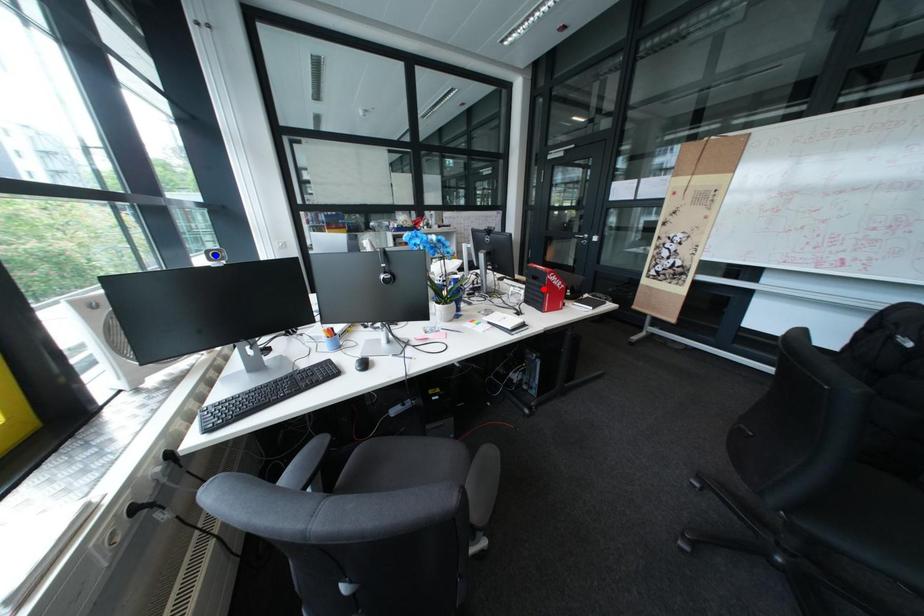
Question: Two points are marked on the image. Which point is closer to the camera?

Choices:
 (A) Blue point is closer.
 (B) Red point is closer.

Answer: (A)